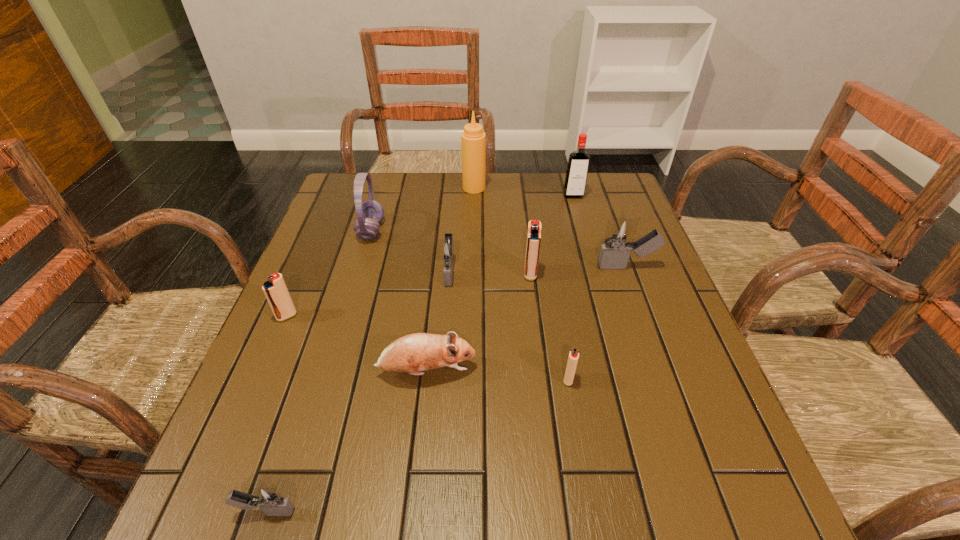
Locate an element on the screen. The height and width of the screenshot is (540, 960). the tallest object is located at coordinates (473, 139).

Locate an element on the screen. The width and height of the screenshot is (960, 540). tan condiment is located at coordinates (473, 139).

What are the coordinates of `red vodka` in the screenshot? It's located at (x=578, y=162).

Locate an element on the screen. The height and width of the screenshot is (540, 960). the third farthest object is located at coordinates (369, 213).

At what (x,y) coordinates should I click in order to perform the action: click on the biggest red igniter. Please return your answer as a coordinate pair (x, y). The image size is (960, 540). Looking at the image, I should click on (534, 226).

You are a GUI agent. You are given a task and a screenshot of the screen. Output one action in this format:
    pyautogui.click(x=<x>, y=<y>)
    Task: Click on the fourth object from right to left
    This screenshot has width=960, height=540.
    Given the screenshot: What is the action you would take?
    pyautogui.click(x=534, y=226)

I want to click on the rightmost igniter, so click(620, 232).

Locate an element on the screen. This screenshot has width=960, height=540. the rightmost gray igniter is located at coordinates (620, 232).

You are a GUI agent. You are given a task and a screenshot of the screen. Output one action in this format:
    pyautogui.click(x=<x>, y=<y>)
    Task: Click on the fourth igniter from right to left
    The width and height of the screenshot is (960, 540).
    Given the screenshot: What is the action you would take?
    pyautogui.click(x=447, y=250)

You are a GUI agent. You are given a task and a screenshot of the screen. Output one action in this format:
    pyautogui.click(x=<x>, y=<y>)
    Task: Click on the second gray igniter from left to right
    
    Given the screenshot: What is the action you would take?
    pyautogui.click(x=447, y=250)